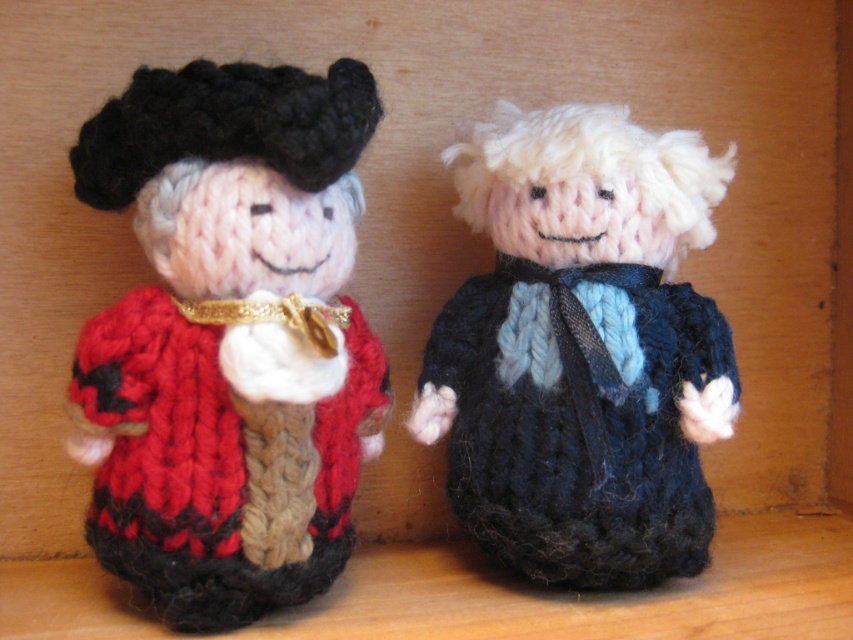
Question: Which of these objects is positioned farthest from the knitted red sweater at left?

Choices:
 (A) knitted woolen doll at center
 (B) knitted blue sweater at center

Answer: (B)

Question: Which point is closer to the camera?

Choices:
 (A) knitted red sweater at left
 (B) knitted woolen doll at center
 (C) knitted blue sweater at center

Answer: (A)

Question: Which of the following is the closest to the observer?

Choices:
 (A) knitted blue sweater at center
 (B) knitted red sweater at left
 (C) knitted woolen doll at center

Answer: (B)

Question: Can you confirm if knitted red sweater at left is positioned above knitted blue sweater at center?

Choices:
 (A) yes
 (B) no

Answer: (A)

Question: In this image, where is knitted red sweater at left located relative to knitted blue sweater at center?

Choices:
 (A) below
 (B) above

Answer: (B)

Question: Can you confirm if knitted red sweater at left is positioned to the right of knitted blue sweater at center?

Choices:
 (A) no
 (B) yes

Answer: (A)